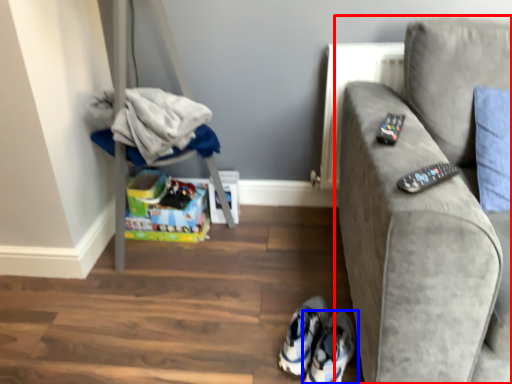
Question: Which object appears closest to the camera in this image, studio couch (highlighted by a red box) or footwear (highlighted by a blue box)?

Choices:
 (A) studio couch
 (B) footwear

Answer: (A)